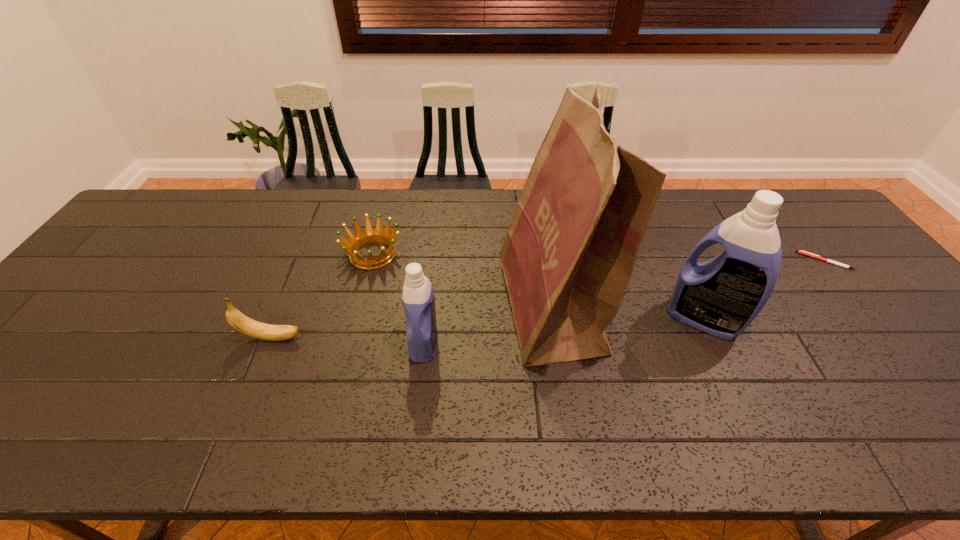
You are a GUI agent. You are given a task and a screenshot of the screen. Output one action in this format:
    pyautogui.click(x=<x>, y=<y>)
    Task: Click on the free point between the fifth object from right to left and the banana
    
    Given the screenshot: What is the action you would take?
    pyautogui.click(x=323, y=296)

Locate an element on the screen. empty space that is in between the tallest object and the second tallest object is located at coordinates (628, 314).

What are the coordinates of `empty space between the third tallest object and the third object from right to left` in the screenshot? It's located at (488, 325).

The height and width of the screenshot is (540, 960). Find the location of `empty space that is in between the third shortest object and the right detergent`. empty space that is in between the third shortest object and the right detergent is located at coordinates (489, 328).

Where is `blank region between the second tallest object and the third shortest object`? blank region between the second tallest object and the third shortest object is located at coordinates (489, 328).

Where is `vacant area between the third object from right to left and the taller detergent`? vacant area between the third object from right to left and the taller detergent is located at coordinates (628, 314).

Where is `object that is the fourth closest one to the left detergent`? object that is the fourth closest one to the left detergent is located at coordinates (722, 296).

Locate which object is the second closest to the fifth tallest object. Please provide its 2D coordinates. Your answer should be formatted as a tuple, i.e. [(x, y)], where the tuple contains the x and y coordinates of a point satisfying the conditions above.

[(244, 324)]

What are the coordinates of `free space that satisfies the following two spatial constraints: 1. at the start of the peel on the third shortest object; 2. on the back side of the third tallest object` in the screenshot? It's located at (271, 342).

This screenshot has height=540, width=960. Find the location of `free space in the image that satisfies the following two spatial constraints: 1. on the front side of the second object from left to right; 2. at the start of the peel on the leftmost object`. free space in the image that satisfies the following two spatial constraints: 1. on the front side of the second object from left to right; 2. at the start of the peel on the leftmost object is located at coordinates click(351, 338).